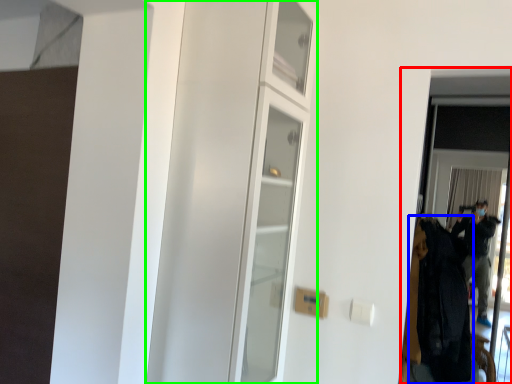
Question: Which object is positioned closest to screen door (highlighted by a red box)? Select from clothing (highlighted by a blue box) and dresser (highlighted by a green box).

Choices:
 (A) clothing
 (B) dresser

Answer: (A)